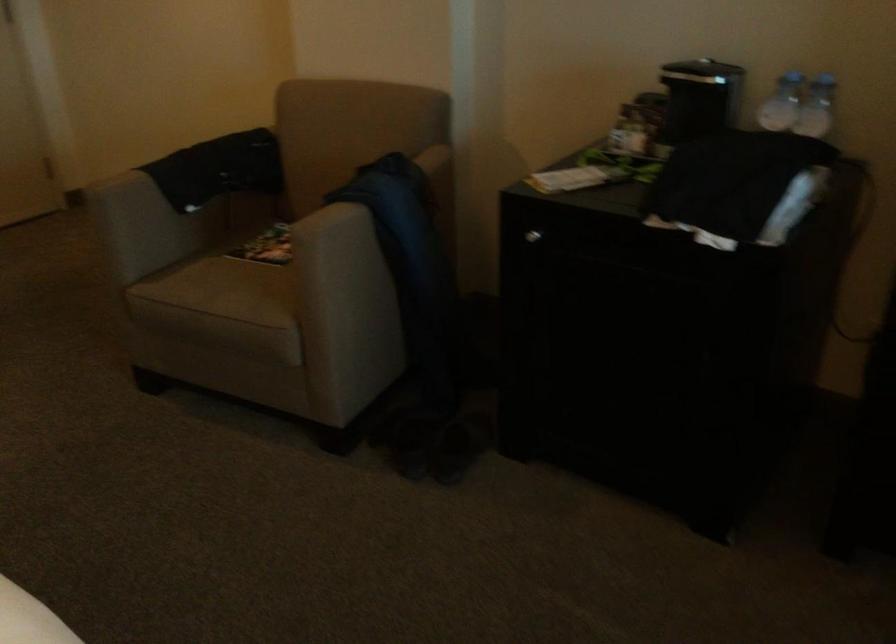
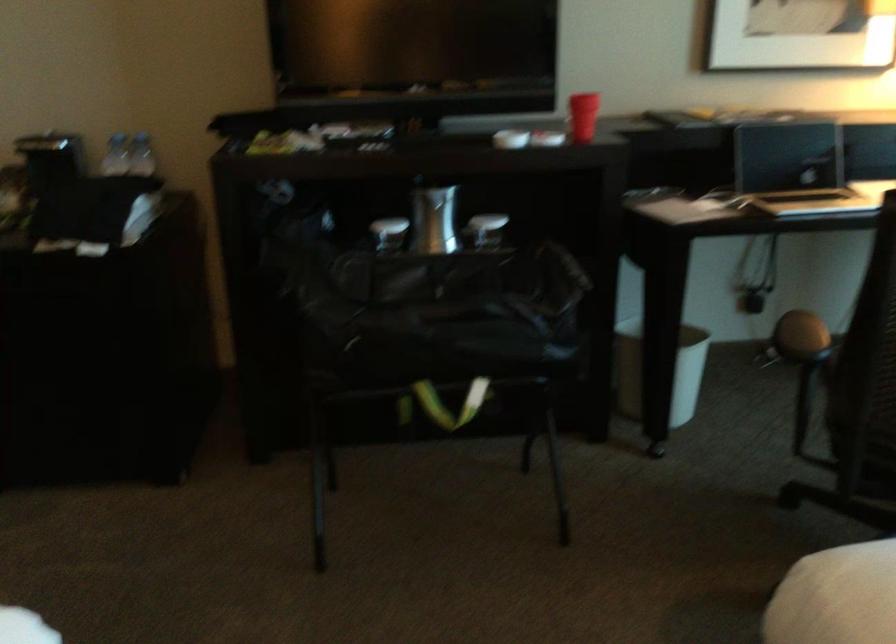
Question: The first image is from the beginning of the video and the second image is from the end. How did the camera likely rotate when shooting the video?

Choices:
 (A) Left
 (B) Right
 (C) Up
 (D) Down

Answer: (B)